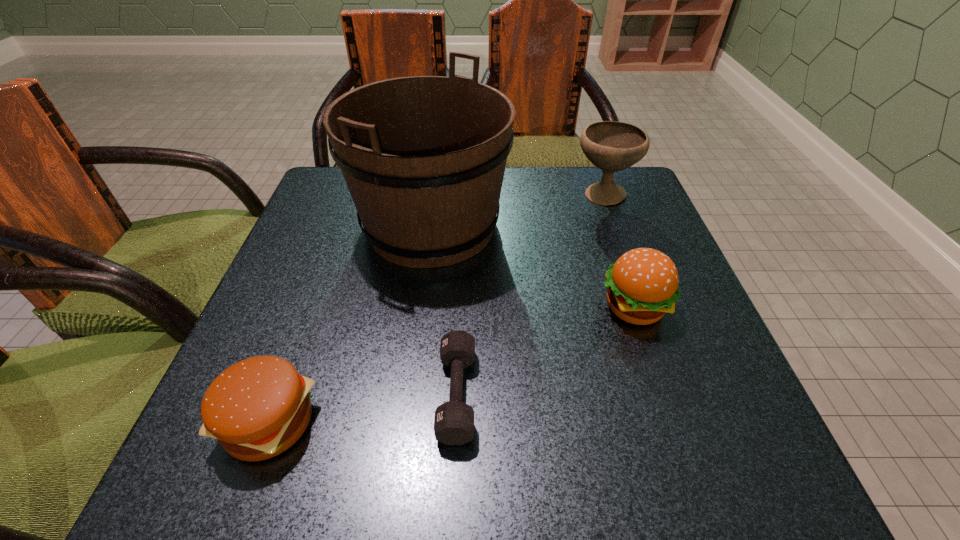
At what (x,y) coordinates should I click in order to perform the action: click on object that is positioned at the far left corner. Please return your answer as a coordinate pair (x, y). The width and height of the screenshot is (960, 540). Looking at the image, I should click on (424, 157).

Identify the location of object that is positioned at the near left corner. (257, 408).

Where is `object present at the far right corner`? object present at the far right corner is located at coordinates (612, 146).

The image size is (960, 540). Identify the location of vacant space at the far edge. (556, 192).

In order to click on vacant region at the near edge in this screenshot , I will do `click(335, 488)`.

Locate an element on the screen. The image size is (960, 540). vacant region at the left edge is located at coordinates (331, 246).

I want to click on vacant space at the right edge, so click(643, 245).

In the image, there is a desktop. At what (x,y) coordinates should I click in order to perform the action: click on free region at the far left corner. Please return your answer as a coordinate pair (x, y). Looking at the image, I should click on (329, 211).

This screenshot has width=960, height=540. I want to click on free space at the near left corner of the desktop, so click(x=266, y=468).

At what (x,y) coordinates should I click in order to perform the action: click on free space at the far right corner. Please return your answer as a coordinate pair (x, y). The height and width of the screenshot is (540, 960). Looking at the image, I should click on (629, 176).